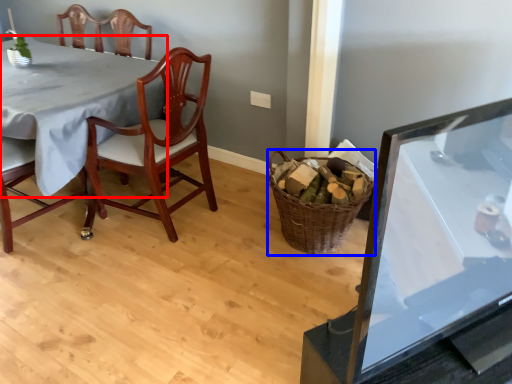
Question: Among these objects, which one is nearest to the camera, table (highlighted by a red box) or basket (highlighted by a blue box)?

Choices:
 (A) table
 (B) basket

Answer: (B)